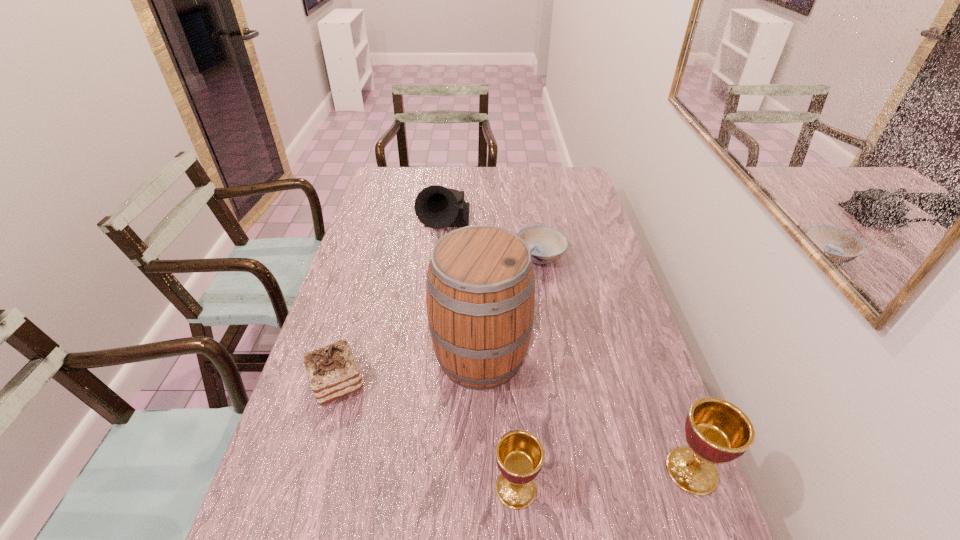
This screenshot has width=960, height=540. Identify the location of vacant space at the left edge of the desktop. (318, 448).

Locate an element on the screen. vacant space at the right edge of the desktop is located at coordinates (570, 235).

Find the location of a particular element. free space at the far right corner of the desktop is located at coordinates (571, 180).

The image size is (960, 540). Find the location of `vacant region between the bowl and the shorter chalice`. vacant region between the bowl and the shorter chalice is located at coordinates (528, 373).

Identify the location of free space between the taller chalice and the left chalice. click(x=604, y=480).

Image resolution: width=960 pixels, height=540 pixels. I want to click on free point between the second shortest object and the tallest object, so click(x=409, y=369).

Find the location of `empty space between the phonograph_record and the right chalice`. empty space between the phonograph_record and the right chalice is located at coordinates (566, 349).

The height and width of the screenshot is (540, 960). Find the location of `empty space between the right chalice and the phonograph_record`. empty space between the right chalice and the phonograph_record is located at coordinates (566, 349).

The image size is (960, 540). I want to click on empty location between the taller chalice and the shortest object, so click(x=616, y=363).

The width and height of the screenshot is (960, 540). I want to click on empty space between the chocolate cake and the fifth shortest object, so click(x=390, y=306).